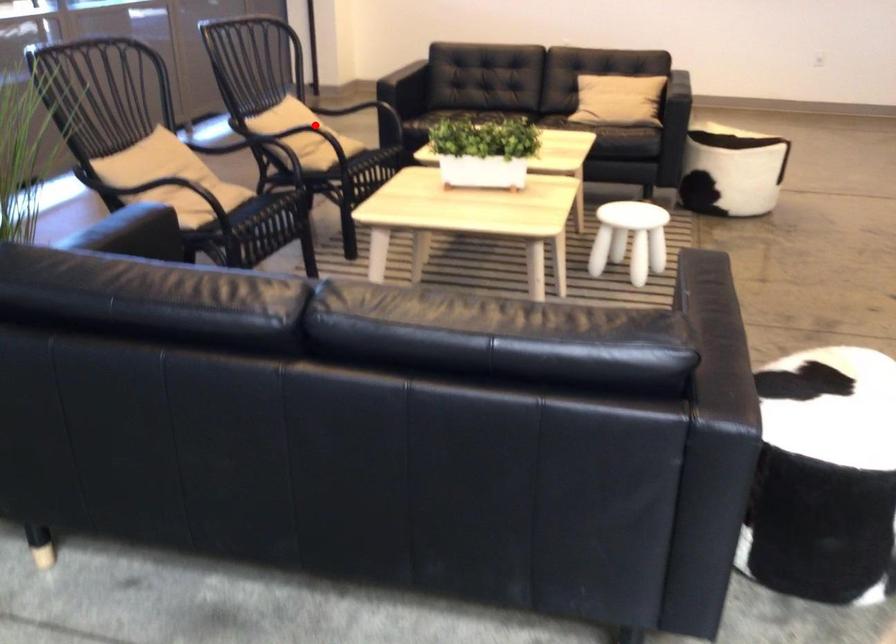
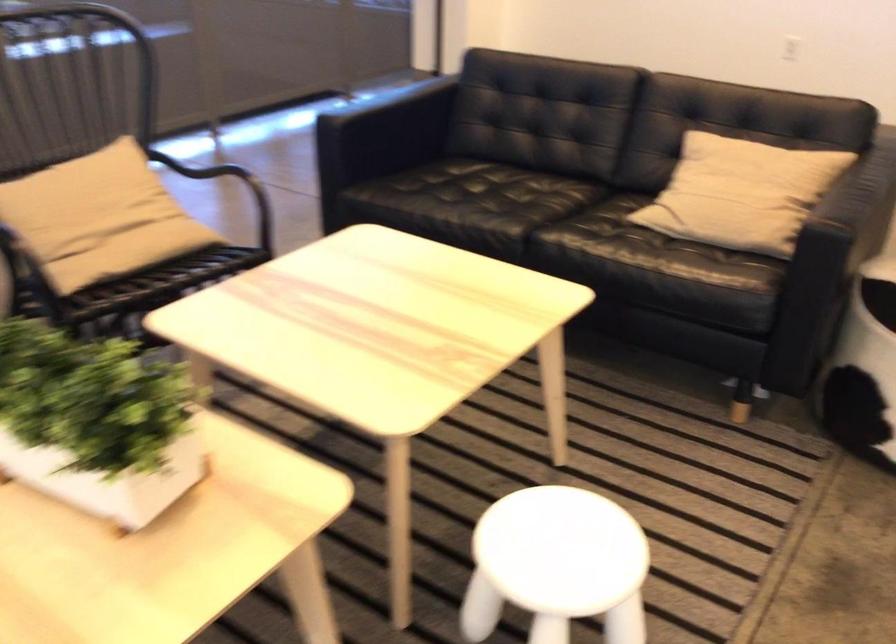
Question: I am providing you with two images of the same scene from different viewpoints. A red point is marked on the first image. Can you still see the location of the red point in image 2?

Choices:
 (A) Yes
 (B) No

Answer: (A)